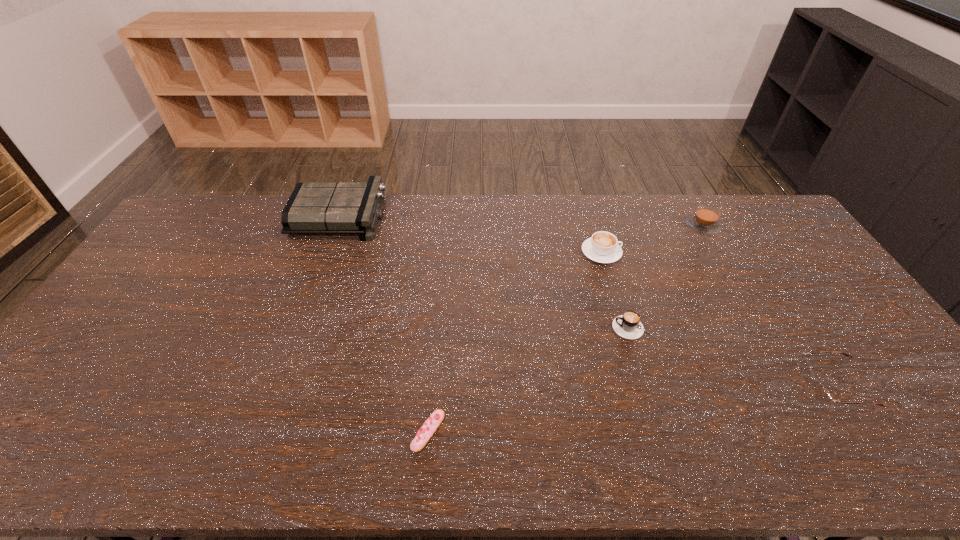
You are a GUI agent. You are given a task and a screenshot of the screen. Output one action in this format:
    pyautogui.click(x=<x>, y=<y>)
    Task: Click on the free spot that satisfies the following two spatial constraints: 1. on the back side of the eclair; 2. on the front panel of the radio receiver
    
    Given the screenshot: What is the action you would take?
    pyautogui.click(x=446, y=217)

Where is `vacant region that satisfies the following two spatial constraints: 1. on the front panel of the leftmost object; 2. on the right side of the second object from left to right`? This screenshot has width=960, height=540. vacant region that satisfies the following two spatial constraints: 1. on the front panel of the leftmost object; 2. on the right side of the second object from left to right is located at coordinates (262, 431).

In order to click on free space that satisfies the following two spatial constraints: 1. on the front panel of the eclair; 2. on the left side of the radio receiver in this screenshot , I will do `click(262, 431)`.